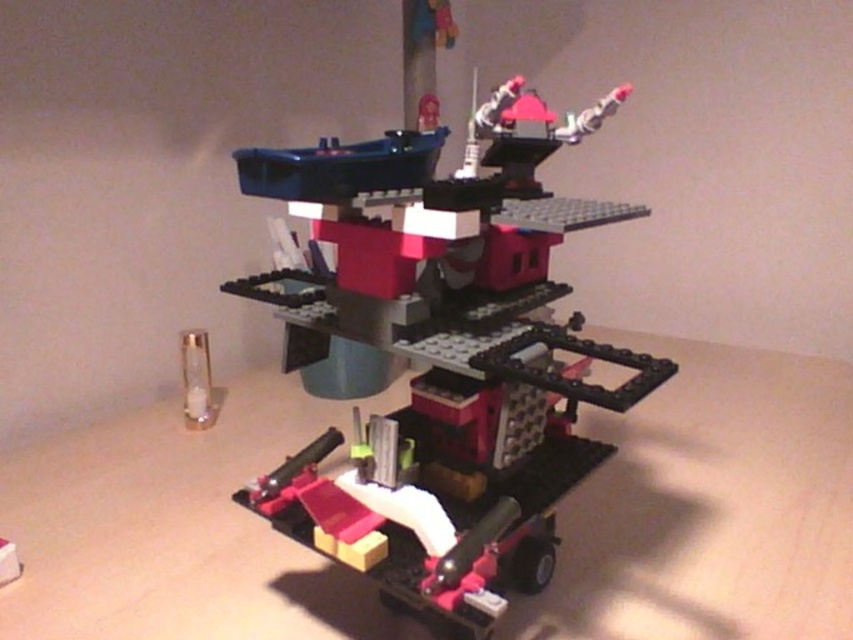
You are a drone operator trying to navigate between two points in the Lego construction. The first point is at coordinate point(21, 616) and the second is at point(461, 172). From your vantage point, which point is closer to the beige wall behind the Lego structure?

Point(21, 616) is behind point(461, 172), so the second point(461, 172) is closer to the beige wall behind the Lego structure.